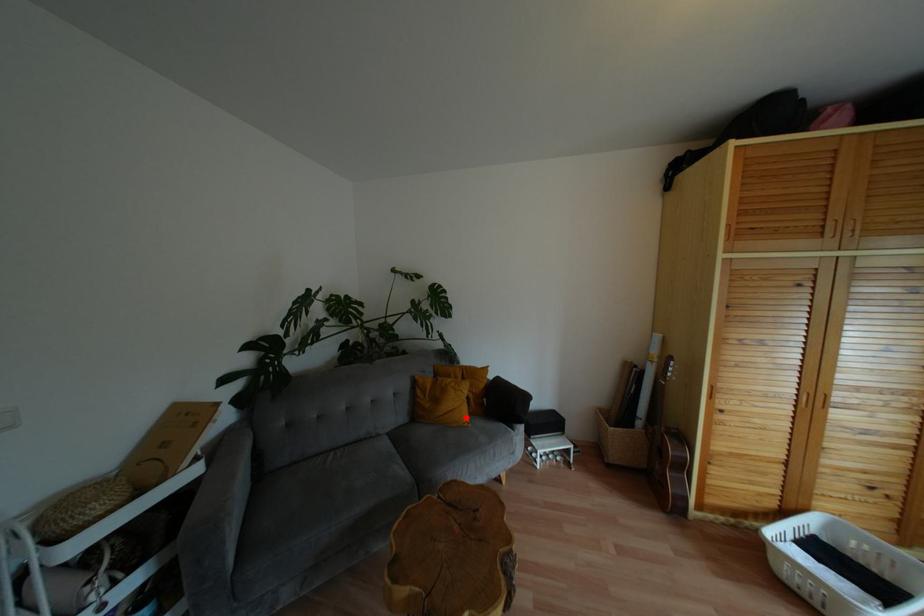
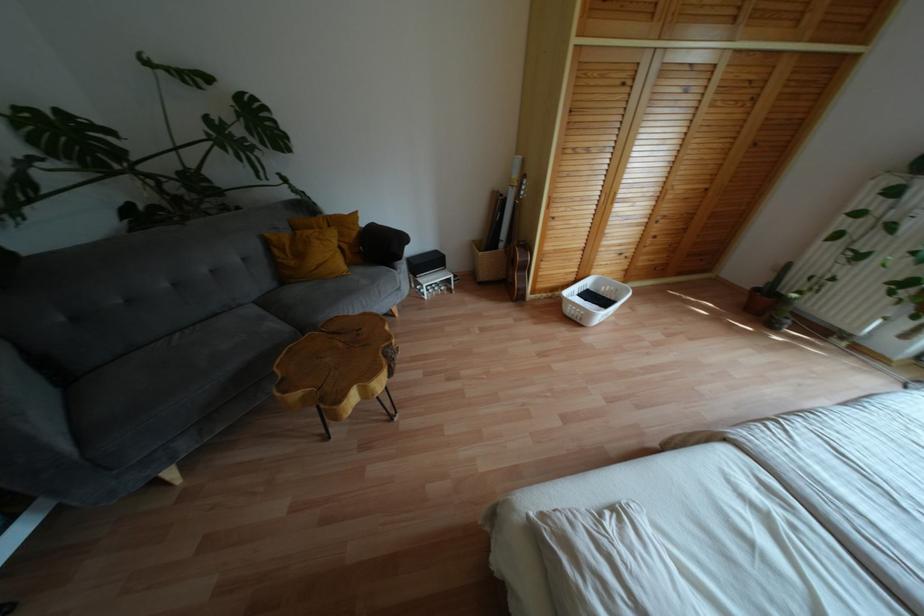
In the second image, find the point that corresponds to the highlighted location in the first image.

(343, 267)